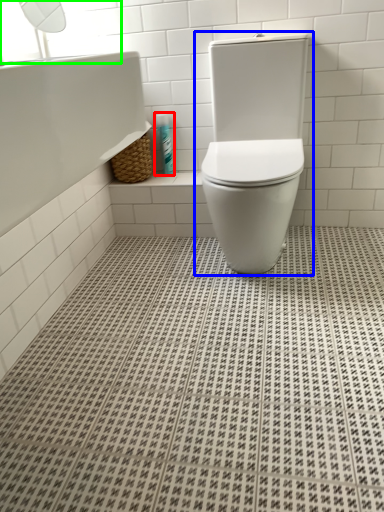
Question: Considering the real-world distances, which object is closest to toiletry (highlighted by a red box)? toilet (highlighted by a blue box) or window screen (highlighted by a green box).

Choices:
 (A) toilet
 (B) window screen

Answer: (A)